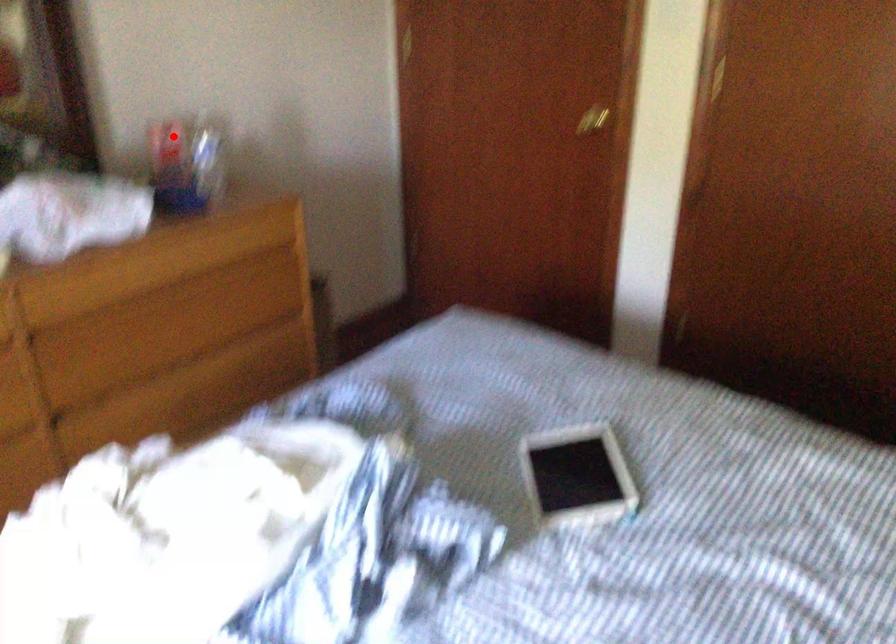
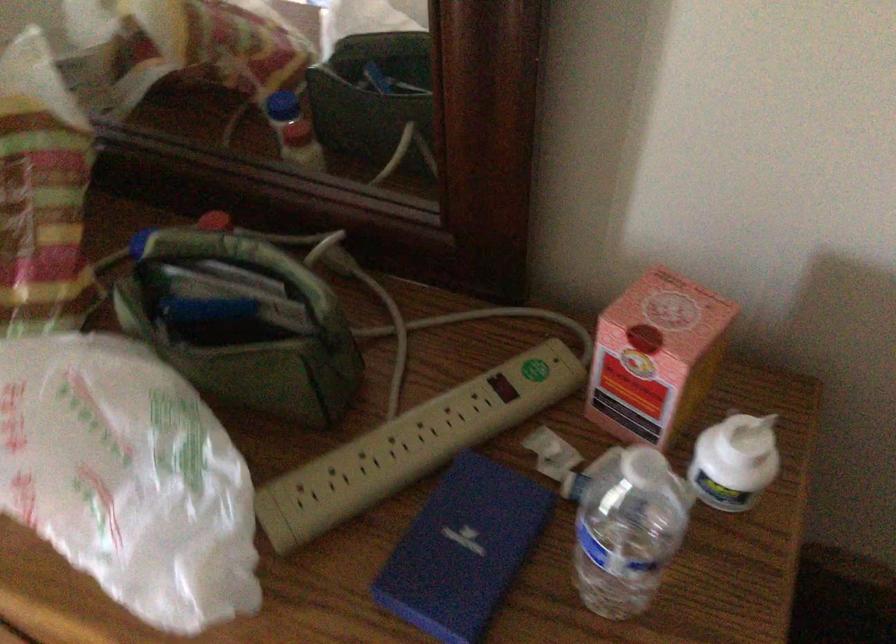
Question: I am providing you with two images of the same scene from different viewpoints. Image1 has a red point marked. In image2, the corresponding 3D location appears at what relative position? Reply with the corresponding letter.

Choices:
 (A) Closer
 (B) Farther

Answer: (A)